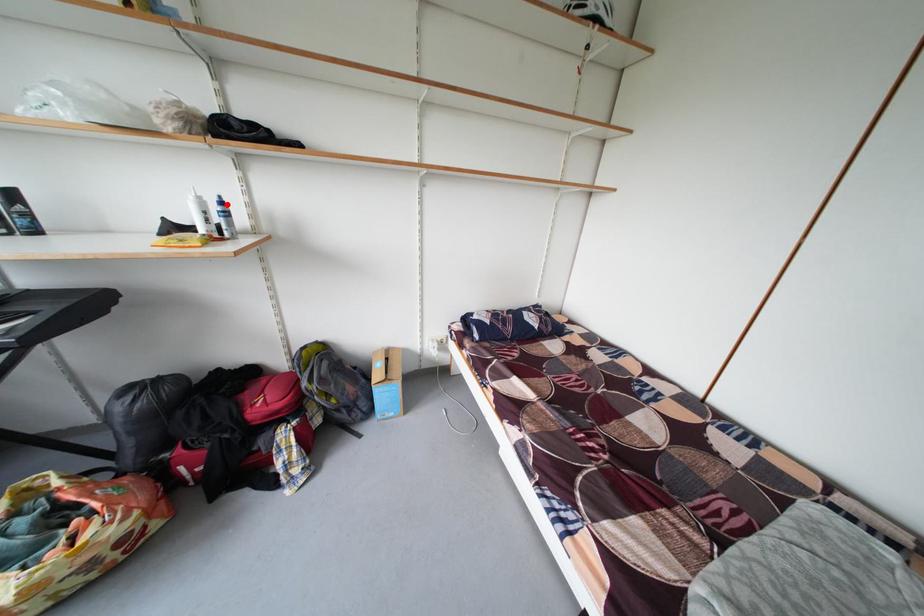
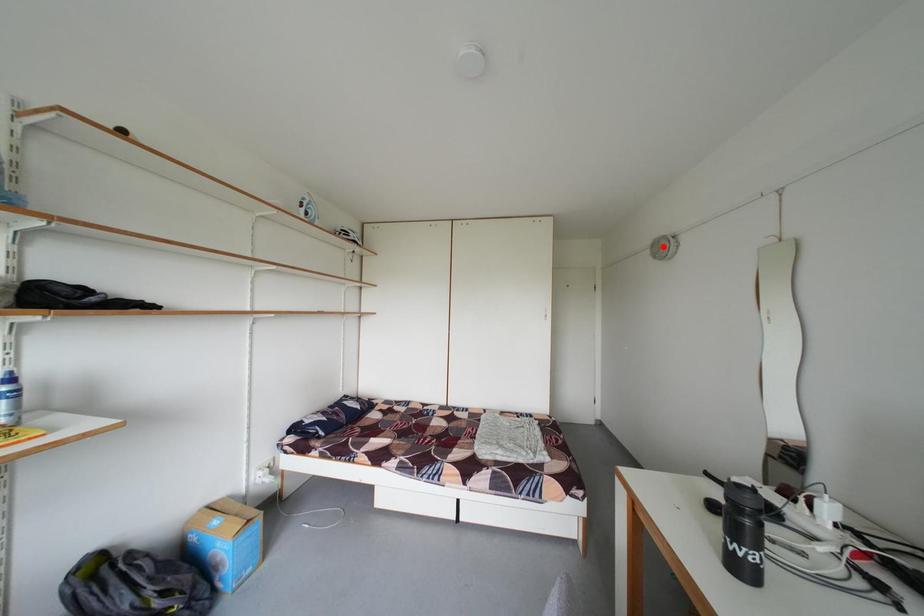
I am providing you with two images of the same scene from different viewpoints. A red point is marked on the first image and another point is marked on the second image. Does the point marked in image1 correspond to the same location as the one in image2?

No